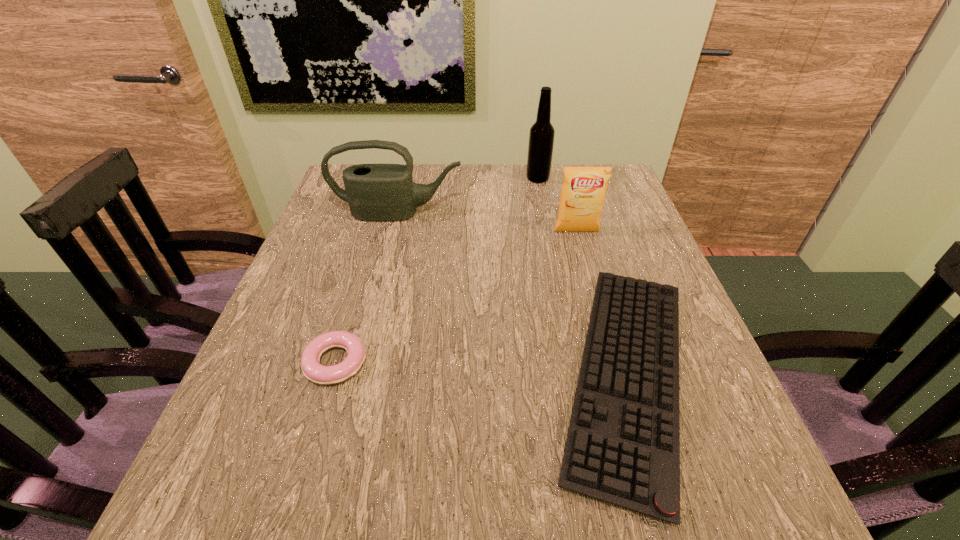
In order to click on free area in between the second farthest object and the computer keyboard in this screenshot , I will do `click(513, 294)`.

The width and height of the screenshot is (960, 540). Find the location of `free spot between the tallest object and the doughnut`. free spot between the tallest object and the doughnut is located at coordinates (437, 271).

This screenshot has height=540, width=960. Find the location of `free area in between the tallest object and the computer keyboard`. free area in between the tallest object and the computer keyboard is located at coordinates (583, 276).

Identify the location of object that ranks as the second closest to the computer keyboard. This screenshot has height=540, width=960. (375, 192).

You are a GUI agent. You are given a task and a screenshot of the screen. Output one action in this format:
    pyautogui.click(x=<x>, y=<y>)
    Task: Click on the object identified as the third closest to the tallest object
    This screenshot has height=540, width=960.
    Given the screenshot: What is the action you would take?
    pyautogui.click(x=623, y=446)

What are the coordinates of `free space that satisfies the following two spatial constraints: 1. on the spout of the second farthest object; 2. on the left side of the computer keyboard` in the screenshot? It's located at click(358, 374).

I want to click on vacant region that satisfies the following two spatial constraints: 1. on the front of the computer keyboard with the logo; 2. on the right side of the third farthest object, so click(x=615, y=374).

Image resolution: width=960 pixels, height=540 pixels. What are the coordinates of `vacant space that satisfies the following two spatial constraints: 1. on the front of the third farthest object with the logo; 2. on the left side of the computer keyboard` in the screenshot? It's located at (615, 374).

Where is `vacant point that satisfies the following two spatial constraints: 1. on the front side of the computer keyboard; 2. on the left side of the doughnut`? vacant point that satisfies the following two spatial constraints: 1. on the front side of the computer keyboard; 2. on the left side of the doughnut is located at coordinates (332, 374).

Locate an element on the screen. vacant space that satisfies the following two spatial constraints: 1. on the front of the computer keyboard with the logo; 2. on the left side of the third nearest object is located at coordinates (615, 374).